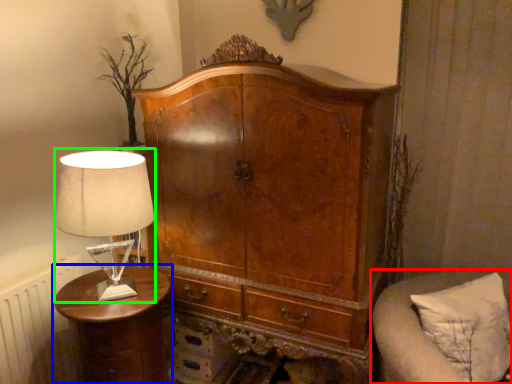
Question: Which is farther away from furniture (highlighted by a red box)? nightstand (highlighted by a blue box) or table lamp (highlighted by a green box)?

Choices:
 (A) nightstand
 (B) table lamp

Answer: (B)